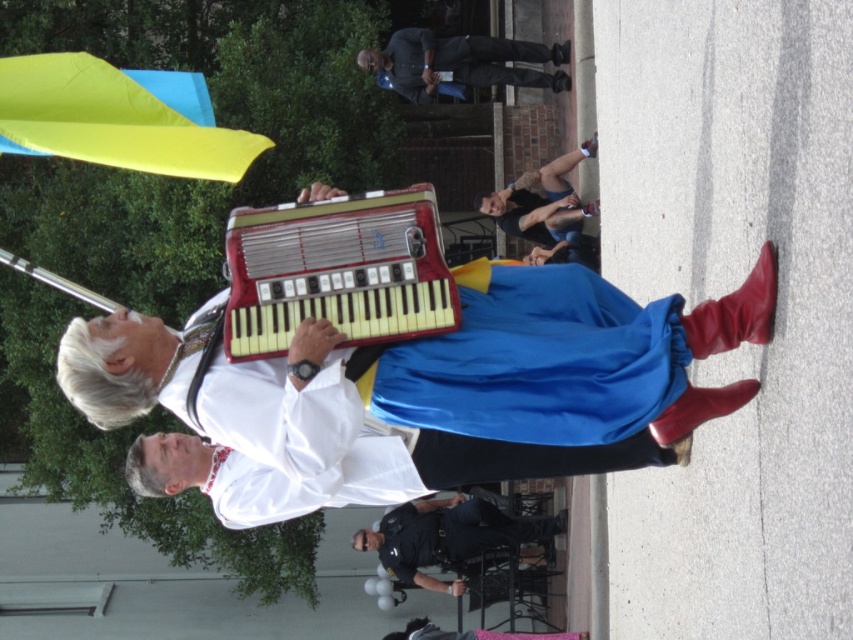
Is point (508, 332) less distant than point (560, 180)?

Yes, point (508, 332) is in front of point (560, 180).

Between matte white accordion at center and blue denim jeans at upper center, which one has more height?

Standing taller between the two is blue denim jeans at upper center.

Between point (668, 442) and point (566, 189), which one is positioned in front?

Positioned in front is point (668, 442).

Identify the location of matte white accordion at center. (431, 392).

Which of these two, matte white accordion at center or dark blue shirt at center, stands taller?

With more height is matte white accordion at center.

Who is more forward, (360, 460) or (448, 65)?

Point (360, 460) is more forward.

Which is in front, point (405, 461) or point (407, 40)?

Point (405, 461) is more forward.

You are a GUI agent. You are given a task and a screenshot of the screen. Output one action in this format:
    pyautogui.click(x=<x>, y=<y>)
    Task: Click on the matte white accordion at center
    The height and width of the screenshot is (640, 853).
    Given the screenshot: What is the action you would take?
    pyautogui.click(x=431, y=392)

Between matte white accordion at center and dark blue uniform at center, which one is positioned lower?

dark blue uniform at center

Can you confirm if matte white accordion at center is positioned to the left of dark blue uniform at center?

Yes, matte white accordion at center is to the left of dark blue uniform at center.

Describe the element at coordinates (431, 392) in the screenshot. I see `matte white accordion at center` at that location.

Where is `matte white accordion at center`? Image resolution: width=853 pixels, height=640 pixels. matte white accordion at center is located at coordinates (431, 392).